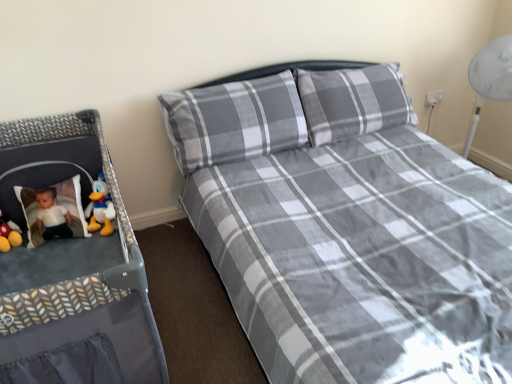
Question: Is gray plaid pillow at center in front of or behind gray plaid bed at center in the image?

Choices:
 (A) front
 (B) behind

Answer: (B)

Question: Looking at the image, does gray plaid pillow at center seem bigger or smaller compared to gray plaid bed at center?

Choices:
 (A) big
 (B) small

Answer: (B)

Question: Which object is the farthest from the gray plaid bed at center?

Choices:
 (A) matte yellow duck at left
 (B) gray plaid pillow at center

Answer: (A)

Question: Which object is positioned closest to the gray plaid bed at center?

Choices:
 (A) matte yellow duck at left
 (B) gray plaid pillow at center

Answer: (B)